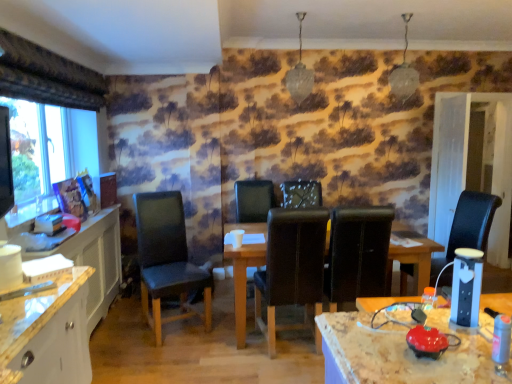
Identify the location of free space that is in between wooden table at center and dark blue leather chair at center, which is counted as the 5th chair, starting from the right. The image size is (512, 384). (206, 333).